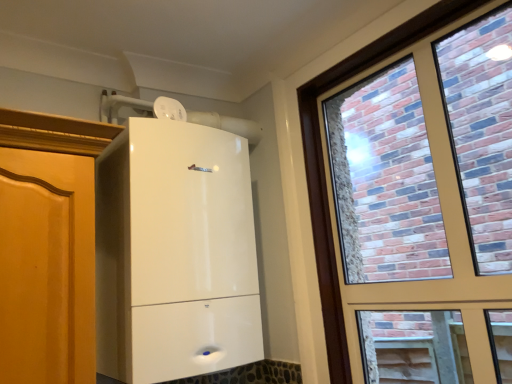
This screenshot has height=384, width=512. What do you see at coordinates (175, 253) in the screenshot? I see `white glossy boiler at center` at bounding box center [175, 253].

Measure the distance between point (x=217, y=132) and camera.

The distance of point (x=217, y=132) from camera is 1.46 meters.

What are the coordinates of `white glossy boiler at center` in the screenshot? It's located at (175, 253).

Describe the element at coordinates (324, 165) in the screenshot. I see `brick-patterned glass window at right` at that location.

The image size is (512, 384). I want to click on brick-patterned glass window at right, so click(324, 165).

Locate an element on the screen. The width and height of the screenshot is (512, 384). white glossy boiler at center is located at coordinates (175, 253).

In the image, is brick-patterned glass window at right on the left side or the right side of white glossy boiler at center?

In the image, brick-patterned glass window at right appears on the right side of white glossy boiler at center.

Considering the positions of objects brick-patterned glass window at right and white glossy boiler at center in the image provided, who is in front, brick-patterned glass window at right or white glossy boiler at center?

brick-patterned glass window at right is in front.

Which point is more distant from viewer, (338, 357) or (177, 190)?

The point (338, 357) is behind.

From the image's perspective, is brick-patterned glass window at right positioned above or below white glossy boiler at center?

brick-patterned glass window at right is situated higher than white glossy boiler at center in the image.

From a real-world perspective, is brick-patterned glass window at right above or below white glossy boiler at center?

Clearly, from a real-world perspective, brick-patterned glass window at right is below white glossy boiler at center.

Considering the sizes of brick-patterned glass window at right and white glossy boiler at center in the image, is brick-patterned glass window at right wider or thinner than white glossy boiler at center?

Considering their sizes, brick-patterned glass window at right looks slimmer than white glossy boiler at center.

In terms of height, does brick-patterned glass window at right look taller or shorter compared to white glossy boiler at center?

In the image, brick-patterned glass window at right appears to be taller than white glossy boiler at center.

Based on their sizes in the image, would you say brick-patterned glass window at right is bigger or smaller than white glossy boiler at center?

In the image, brick-patterned glass window at right appears to be smaller than white glossy boiler at center.

Is brick-patterned glass window at right not within white glossy boiler at center?

Absolutely, brick-patterned glass window at right is external to white glossy boiler at center.

Is brick-patterned glass window at right far from white glossy boiler at center?

No, there isn't a large distance between brick-patterned glass window at right and white glossy boiler at center.

Is brick-patterned glass window at right oriented away from white glossy boiler at center?

brick-patterned glass window at right does not have its back to white glossy boiler at center.

What's the angular difference between brick-patterned glass window at right and white glossy boiler at center's facing directions?

The angle between the facing direction of brick-patterned glass window at right and the facing direction of white glossy boiler at center is 90 degrees.

At what (x,y) coordinates should I click in order to perform the action: click on window below the white glossy boiler at center (from a real-world perspective). Please return your answer as a coordinate pair (x, y). The image size is (512, 384). Looking at the image, I should click on (324, 165).

Is white glossy boiler at center to the left or to the right of brick-patterned glass window at right in the image?

In the image, white glossy boiler at center appears on the left side of brick-patterned glass window at right.

Which object is more forward, white glossy boiler at center or brick-patterned glass window at right?

Positioned in front is brick-patterned glass window at right.

Is point (215, 168) in front of point (414, 37)?

No, (215, 168) is further to viewer.

From the image's perspective, between white glossy boiler at center and brick-patterned glass window at right, which one is located above?

brick-patterned glass window at right appears higher in the image.

From a real-world perspective, is white glossy boiler at center located beneath brick-patterned glass window at right?

No, from a real-world perspective, white glossy boiler at center is not below brick-patterned glass window at right.

Between white glossy boiler at center and brick-patterned glass window at right, which one has smaller width?

With smaller width is brick-patterned glass window at right.

In the scene shown: Considering the sizes of white glossy boiler at center and brick-patterned glass window at right in the image, is white glossy boiler at center taller or shorter than brick-patterned glass window at right?

In the image, white glossy boiler at center appears to be shorter than brick-patterned glass window at right.

Can you confirm if white glossy boiler at center is smaller than brick-patterned glass window at right?

No.

Do you think white glossy boiler at center is within brick-patterned glass window at right, or outside of it?

white glossy boiler at center exists outside the volume of brick-patterned glass window at right.

Is white glossy boiler at center far away from brick-patterned glass window at right?

That's not correct — white glossy boiler at center is a little close to brick-patterned glass window at right.

Is white glossy boiler at center looking in the opposite direction of brick-patterned glass window at right?

That's not correct — white glossy boiler at center is not looking away from brick-patterned glass window at right.

How different are the orientations of white glossy boiler at center and brick-patterned glass window at right in degrees?

The facing directions of white glossy boiler at center and brick-patterned glass window at right are 90 degrees apart.

Measure the distance from white glossy boiler at center to brick-patterned glass window at right.

The distance of white glossy boiler at center from brick-patterned glass window at right is 18.40 inches.

Find the location of a particular element. This screenshot has height=384, width=512. window that is on the right side of white glossy boiler at center is located at coordinates (324, 165).

Identify the location of window on the right of white glossy boiler at center. The width and height of the screenshot is (512, 384). (324, 165).

Where is `window in front of the white glossy boiler at center`? The width and height of the screenshot is (512, 384). window in front of the white glossy boiler at center is located at coordinates (324, 165).